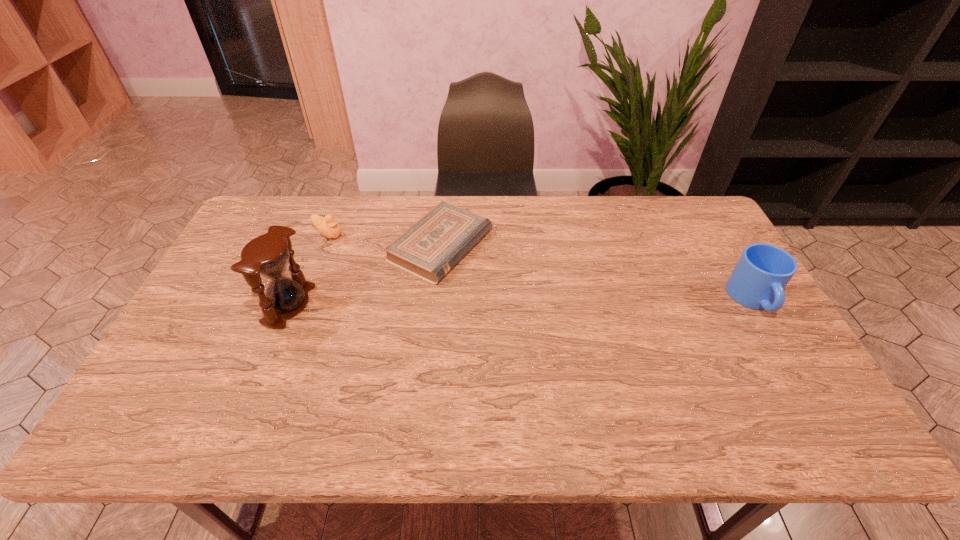
In the image, there is a desktop. Where is `free space at the right edge`? The width and height of the screenshot is (960, 540). free space at the right edge is located at coordinates (704, 253).

Find the location of `blank space at the far right corner of the desktop`. blank space at the far right corner of the desktop is located at coordinates (681, 205).

Identify the location of free space between the second shortest object and the rightmost object. The width and height of the screenshot is (960, 540). (540, 267).

Where is `vacant space that is in between the tallest object and the third tallest object`? vacant space that is in between the tallest object and the third tallest object is located at coordinates (308, 269).

This screenshot has height=540, width=960. In order to click on free area in between the third object from left to right and the mug in this screenshot , I will do `click(597, 273)`.

You are a GUI agent. You are given a task and a screenshot of the screen. Output one action in this format:
    pyautogui.click(x=<x>, y=<y>)
    Task: Click on the empty space between the duckling and the second tallest object
    
    Given the screenshot: What is the action you would take?
    pyautogui.click(x=540, y=267)

Locate an element on the screen. This screenshot has height=540, width=960. vacant region between the duckling and the second object from right to left is located at coordinates (384, 240).

Where is `vacant region between the rightmost object and the third object from left to right`? vacant region between the rightmost object and the third object from left to right is located at coordinates pyautogui.click(x=597, y=273).

Find the location of `free point between the tallest object and the second tallest object`. free point between the tallest object and the second tallest object is located at coordinates 521,302.

Where is `free space between the Bible and the third shortest object`? The height and width of the screenshot is (540, 960). free space between the Bible and the third shortest object is located at coordinates (597, 273).